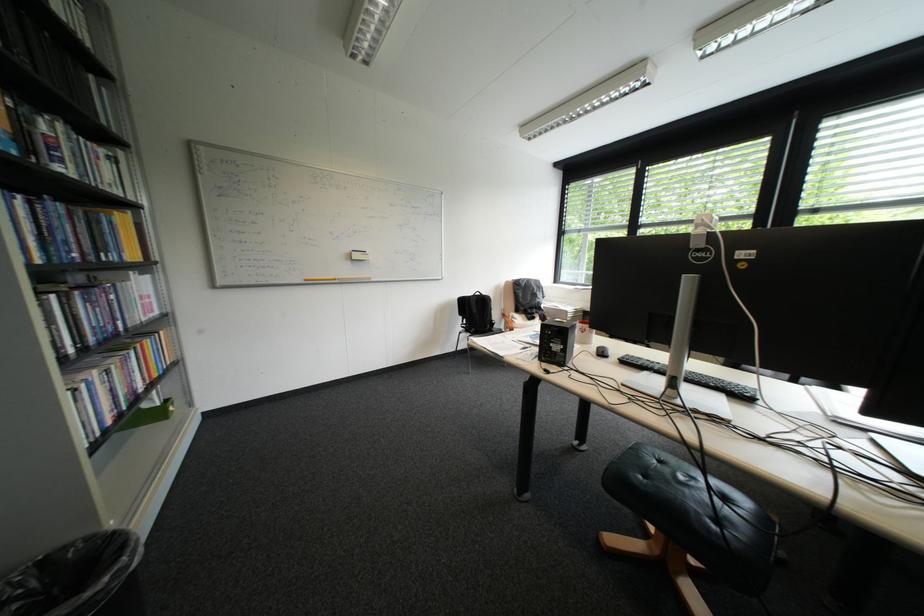
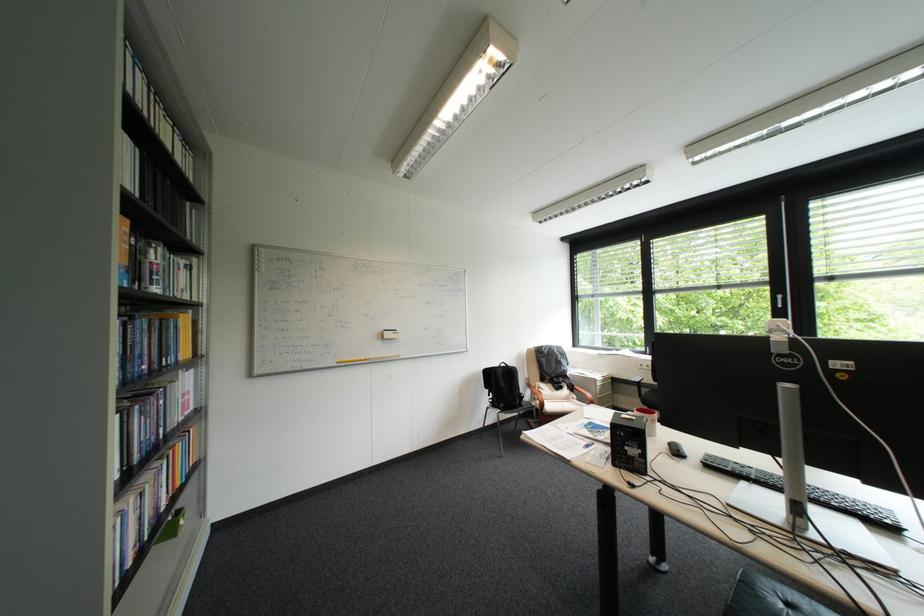
Locate, in the second image, the point that corresponds to the point at 76,213 in the first image.

(159, 326)